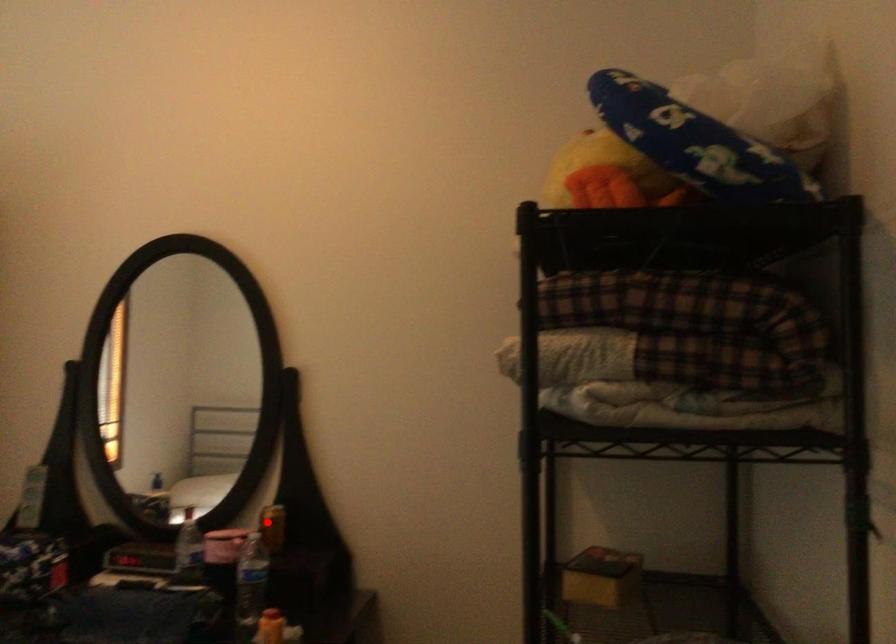
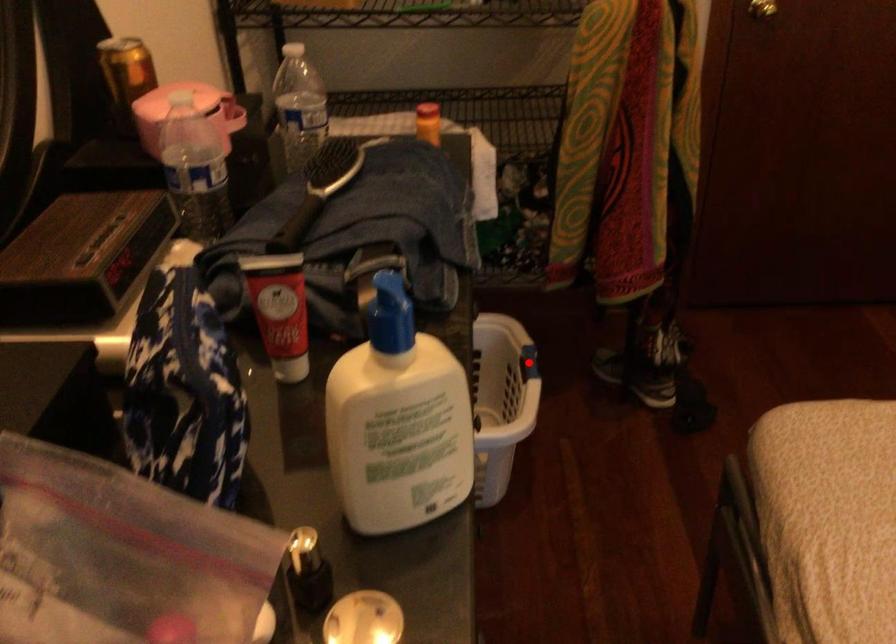
I am providing you with two images of the same scene from different viewpoints. A red point is marked on the first image and another point is marked on the second image. Are the points marked in image1 and image2 representing the same 3D position?

No